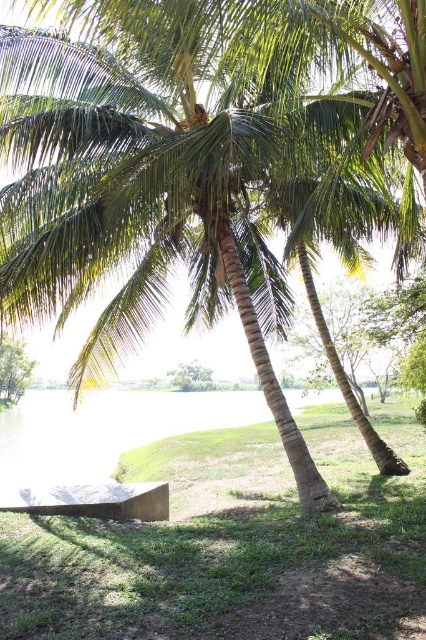
Question: Is wooden bench at lower left to the right of green leafy tree at center from the viewer's perspective?

Choices:
 (A) yes
 (B) no

Answer: (B)

Question: Does green leafy palm tree at lower left come in front of green leafy tree at center?

Choices:
 (A) yes
 (B) no

Answer: (A)

Question: Among these points, which one is nearest to the camera?

Choices:
 (A) tap(14, 355)
 (B) tap(201, 369)
 (C) tap(166, 515)

Answer: (C)

Question: Is wooden bench at lower left closer to the viewer compared to green leafy palm tree at lower left?

Choices:
 (A) yes
 (B) no

Answer: (A)

Question: Which point appears closest to the camera in this image?

Choices:
 (A) (14, 364)
 (B) (149, 483)

Answer: (B)

Question: Which point is farther from the camera taking this photo?

Choices:
 (A) (115, 499)
 (B) (14, 342)

Answer: (B)